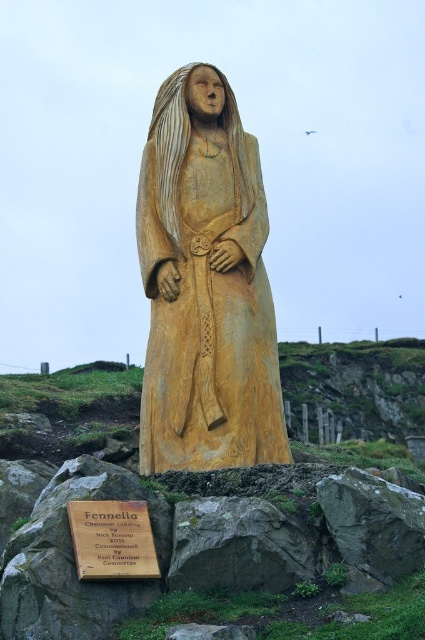
Is wooden statue at center above wooden plaque at lower center?

Indeed, wooden statue at center is positioned over wooden plaque at lower center.

Does wooden statue at center have a greater height compared to wooden plaque at lower center?

Correct, wooden statue at center is much taller as wooden plaque at lower center.

Between point (232, 104) and point (130, 570), which one is positioned behind?

Point (232, 104)

Image resolution: width=425 pixels, height=640 pixels. In order to click on wooden statue at center in this screenshot , I will do `click(206, 285)`.